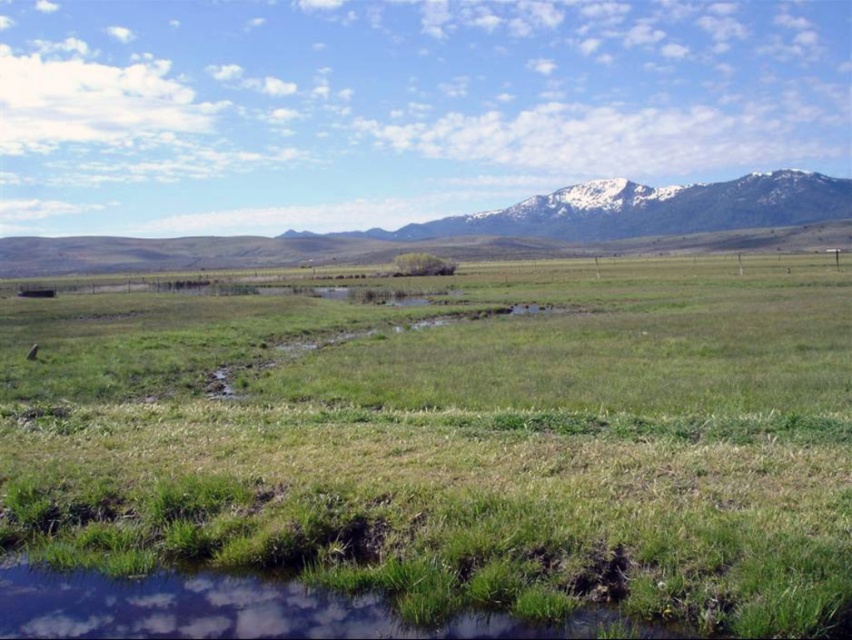
Question: Is green grassy field at center bigger than snowy rock mountain range at upper right?

Choices:
 (A) no
 (B) yes

Answer: (A)

Question: Is green grassy field at center below snowy rock mountain range at upper right?

Choices:
 (A) yes
 (B) no

Answer: (A)

Question: Does green grassy field at center appear on the left side of snowy rock mountain range at upper right?

Choices:
 (A) yes
 (B) no

Answer: (B)

Question: Which point is closer to the camera taking this photo?

Choices:
 (A) (432, 232)
 (B) (292, 547)

Answer: (B)